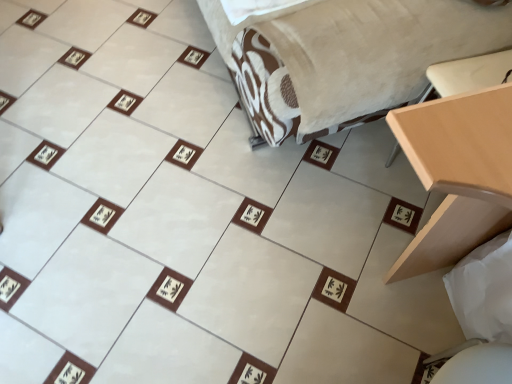
Question: Considering the positions of velvet beige bed at center and light wood table at right in the image, is velvet beige bed at center wider or thinner than light wood table at right?

Choices:
 (A) wide
 (B) thin

Answer: (A)

Question: Is velvet beige bed at center taller or shorter than light wood table at right?

Choices:
 (A) tall
 (B) short

Answer: (B)

Question: Based on their relative distances, which object is farther from the light wood table at right?

Choices:
 (A) velvet beige bed at center
 (B) white fabric sheet at lower right

Answer: (A)

Question: Based on their relative distances, which object is nearer to the velvet beige bed at center?

Choices:
 (A) white fabric sheet at lower right
 (B) light wood table at right

Answer: (B)